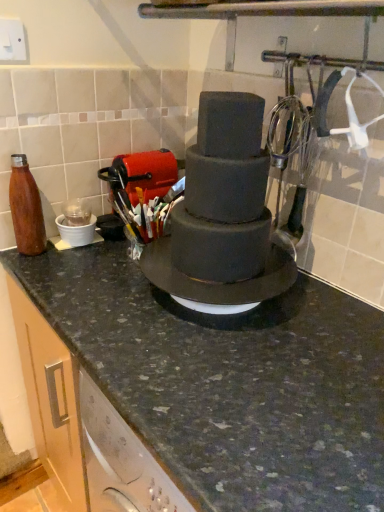
Question: Is the position of matte brown bottle at left more distant than that of granite countertop at center?

Choices:
 (A) yes
 (B) no

Answer: (A)

Question: Is matte brown bottle at left touching granite countertop at center?

Choices:
 (A) no
 (B) yes

Answer: (A)

Question: Are matte brown bottle at left and granite countertop at center located far from each other?

Choices:
 (A) yes
 (B) no

Answer: (B)

Question: Is matte brown bottle at left looking in the opposite direction of granite countertop at center?

Choices:
 (A) yes
 (B) no

Answer: (B)

Question: Is matte brown bottle at left aimed at granite countertop at center?

Choices:
 (A) yes
 (B) no

Answer: (B)

Question: From the image's perspective, would you say matte brown bottle at left is shown under granite countertop at center?

Choices:
 (A) yes
 (B) no

Answer: (B)

Question: Does granite countertop at center appear on the left side of smooth matte chocolate cake at center?

Choices:
 (A) no
 (B) yes

Answer: (A)

Question: Does granite countertop at center have a smaller size compared to smooth matte chocolate cake at center?

Choices:
 (A) no
 (B) yes

Answer: (A)

Question: Can you confirm if granite countertop at center is bigger than smooth matte chocolate cake at center?

Choices:
 (A) yes
 (B) no

Answer: (A)

Question: From the image's perspective, would you say granite countertop at center is positioned over smooth matte chocolate cake at center?

Choices:
 (A) no
 (B) yes

Answer: (A)

Question: Can you confirm if granite countertop at center is positioned to the right of smooth matte chocolate cake at center?

Choices:
 (A) yes
 (B) no

Answer: (A)

Question: Can you confirm if granite countertop at center is wider than smooth matte chocolate cake at center?

Choices:
 (A) yes
 (B) no

Answer: (A)

Question: Can you confirm if smooth matte chocolate cake at center is wider than granite countertop at center?

Choices:
 (A) no
 (B) yes

Answer: (A)